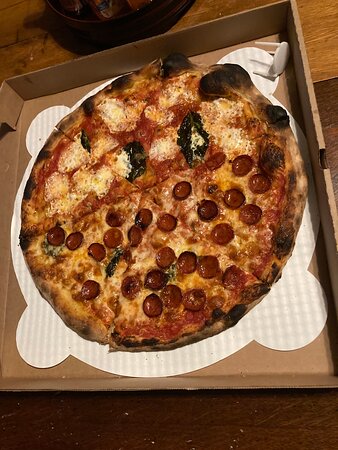
What are the coordinates of `wooden table` in the screenshot? It's located at (316, 16).